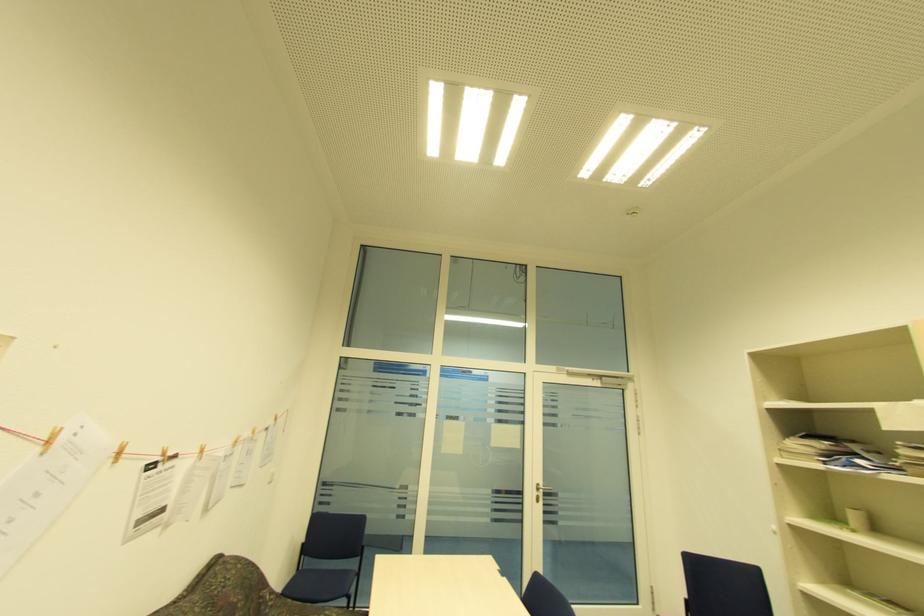
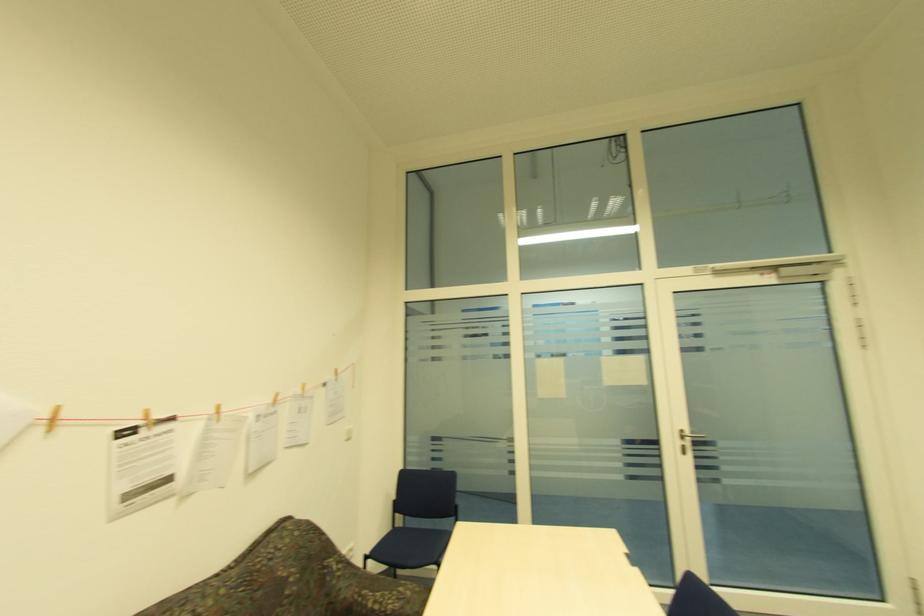
In the second image, find the point that corresponds to pixel 163 454 in the first image.

(141, 416)